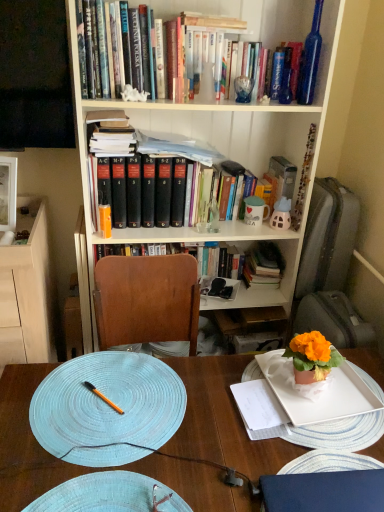
This screenshot has height=512, width=384. Find the location of `free space that is to the left of orange glossy pen at center`. free space that is to the left of orange glossy pen at center is located at coordinates (48, 399).